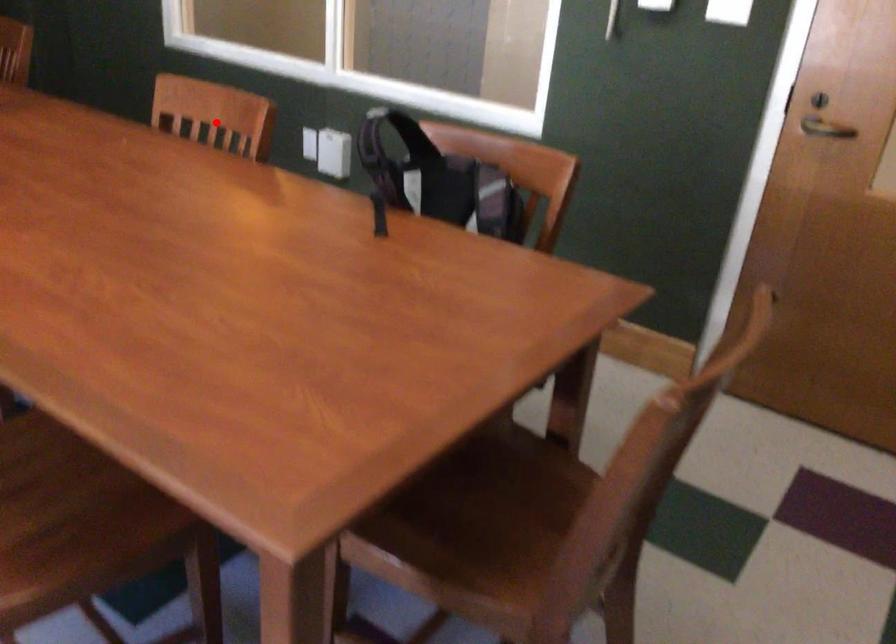
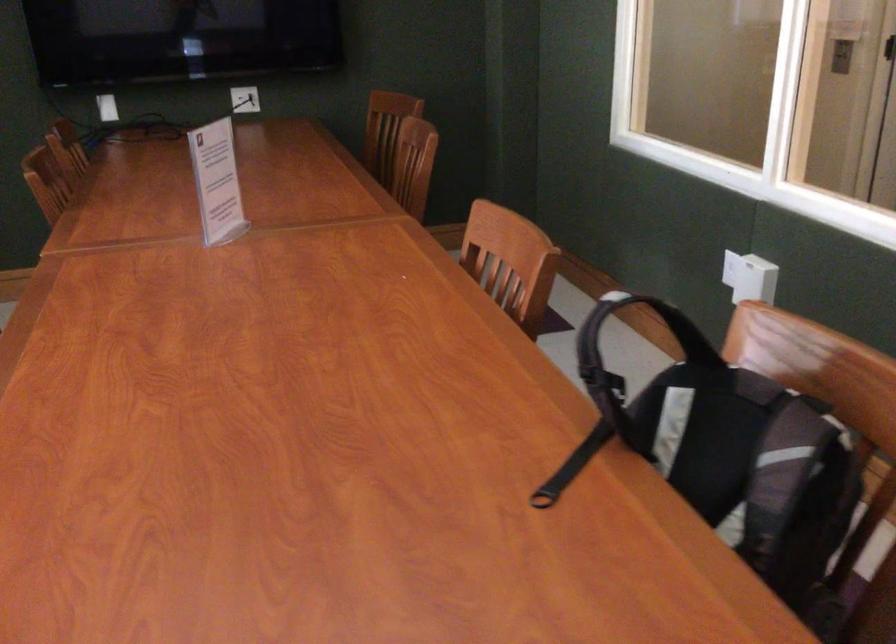
Question: A red point is marked in image1. In image2, is the corresponding 3D point closer to the camera or farther? Reply with the corresponding letter.

Choices:
 (A) The corresponding 3D point is closer.
 (B) The corresponding 3D point is farther.

Answer: (A)